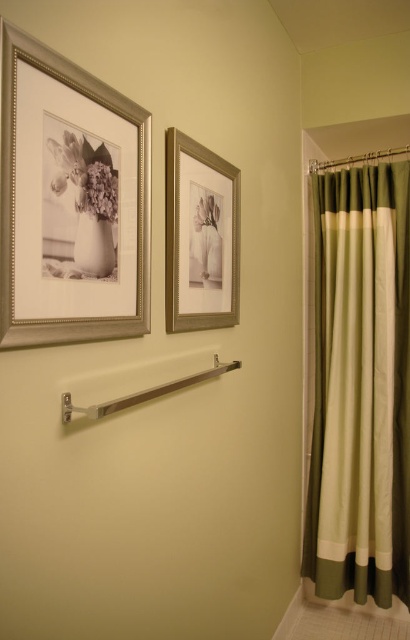
Question: In this image, where is matte white vase at upper left located relative to white glossy vase at upper left?

Choices:
 (A) below
 (B) above

Answer: (B)

Question: Estimate the real-world distances between objects in this image. Which object is farther from the green fabric shower curtain at right?

Choices:
 (A) white glossy vase at upper left
 (B) satin nickel towel bar at center
 (C) silver/golden metallic picture frame at upper left
 (D) matte floral print at upper left

Answer: (D)

Question: Estimate the real-world distances between objects in this image. Which object is farther from the matte silver picture frame at upper center?

Choices:
 (A) matte floral print at upper left
 (B) white matte flower at upper center

Answer: (A)

Question: Estimate the real-world distances between objects in this image. Which object is closer to the satin nickel towel bar at center?

Choices:
 (A) white glossy vase at upper left
 (B) matte floral print at upper left
 (C) matte white vase at upper left

Answer: (A)

Question: Does matte white vase at upper left have a greater width compared to white glossy vase at upper left?

Choices:
 (A) yes
 (B) no

Answer: (A)

Question: Can you confirm if white glossy vase at upper left is thinner than white matte flower at upper center?

Choices:
 (A) yes
 (B) no

Answer: (A)